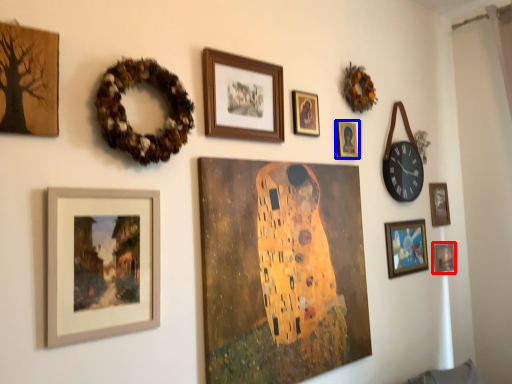
Question: Which point is further to the camera, picture frame (highlighted by a red box) or picture frame (highlighted by a blue box)?

Choices:
 (A) picture frame
 (B) picture frame

Answer: (A)